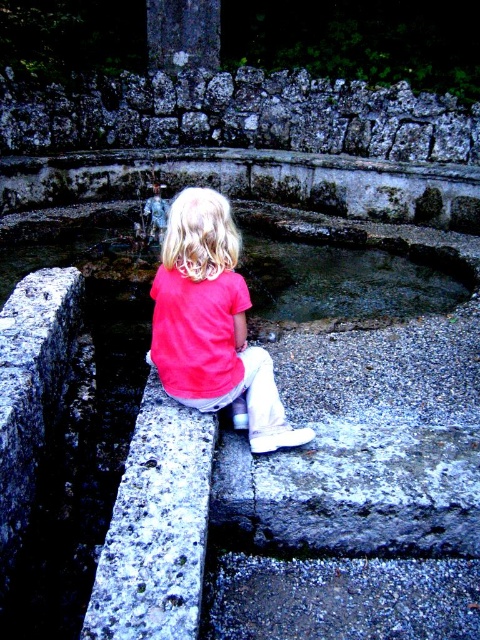
You are a visitor in the park and want to take a photo of the rough stone wall at upper center. The camera you have can only focus on objects within a 0.2 unit radius from the center point. Is the point you marked at coordinates (239, 115) within the focus range of your camera if you aim at the center of the rough stone wall at upper center?

The point marked at coordinates (239, 115) is exactly where the rough stone wall at upper center is located. Since the camera focuses within a 0.2 unit radius from the center point, aiming at the center of the rough stone wall at upper center would include the marked point within the focus range.

You are a photographer trying to capture the rough stone wall at upper center and the pink matte shirt at center in the same frame. Based on their positions, which object should you adjust your camera to focus on first to ensure both are in the shot?

The rough stone wall at upper center is positioned on the right side of the pink matte shirt at center. To ensure both are in the shot, focus on the pink matte shirt at center first, then adjust the camera to include the rough stone wall at upper center on its right side.

You are a painter wanting to capture the scene accurately. You notice the rough stone wall at upper center and the smooth stone water at center. Which object occupies more horizontal space in the image?

The rough stone wall at upper center occupies more horizontal space than the smooth stone water at center, as its width surpasses the latter.